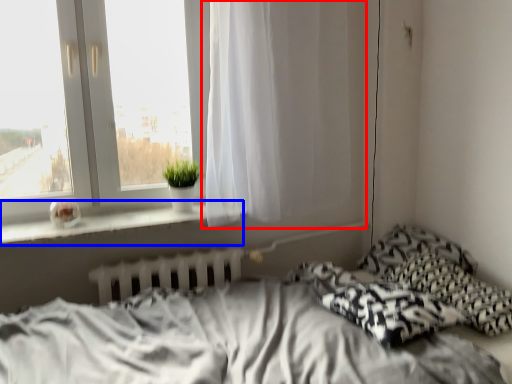
Question: Which point is closer to the camera, curtain (highlighted by a red box) or window sill (highlighted by a blue box)?

Choices:
 (A) curtain
 (B) window sill

Answer: (B)